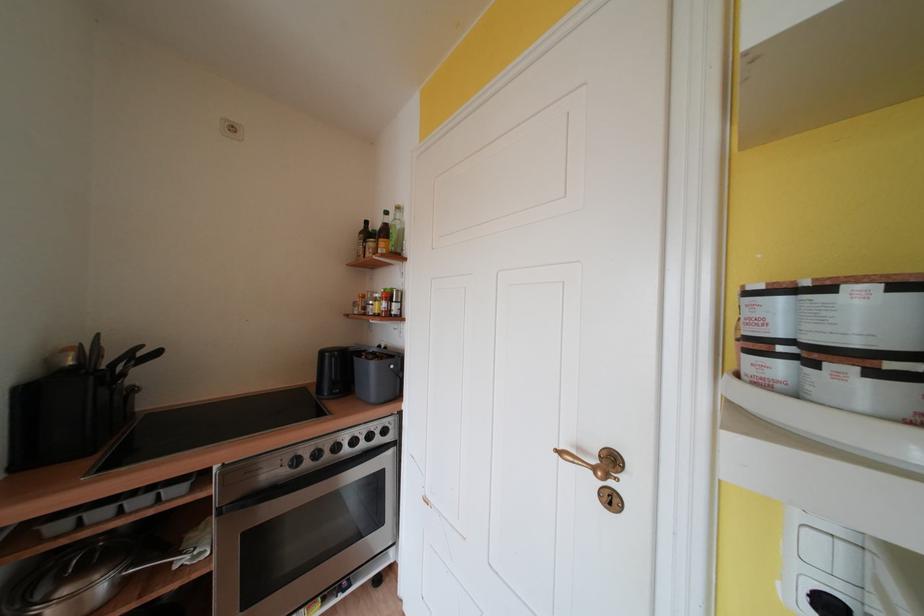
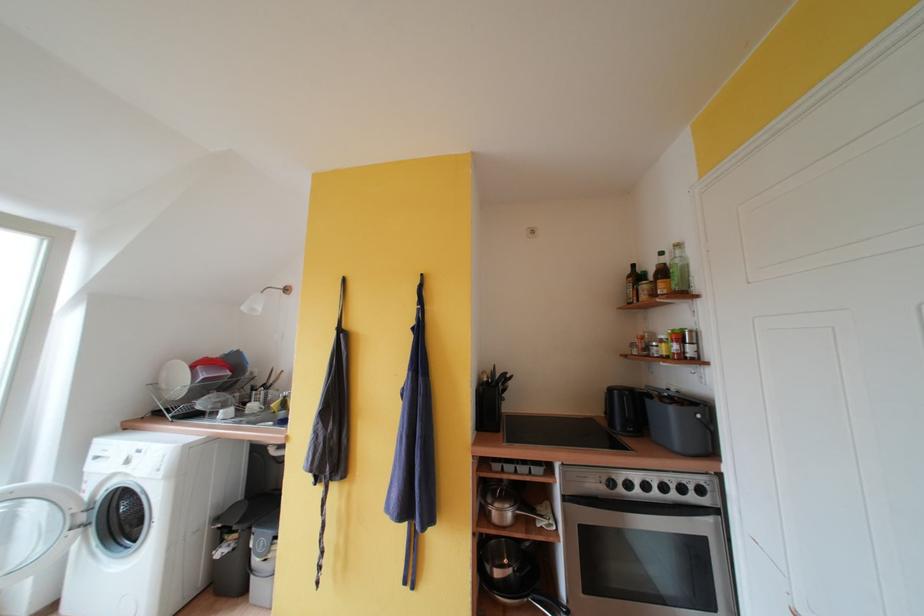
Find the pixel in the second image that matches [391,308] in the first image.

(682, 350)